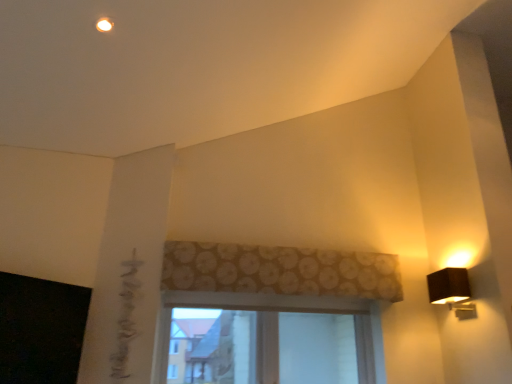
Question: Are black fabric lamp at right and clear glass window at center making contact?

Choices:
 (A) no
 (B) yes

Answer: (A)

Question: Is the position of black fabric lamp at right more distant than that of clear glass window at center?

Choices:
 (A) yes
 (B) no

Answer: (B)

Question: Does black fabric lamp at right have a greater height compared to clear glass window at center?

Choices:
 (A) no
 (B) yes

Answer: (A)

Question: Can you confirm if black fabric lamp at right is bigger than clear glass window at center?

Choices:
 (A) yes
 (B) no

Answer: (B)

Question: Is black fabric lamp at right oriented towards clear glass window at center?

Choices:
 (A) yes
 (B) no

Answer: (A)

Question: Does black fabric lamp at right have a smaller size compared to clear glass window at center?

Choices:
 (A) no
 (B) yes

Answer: (B)

Question: Is brown floral fabric at center bigger than black fabric lamp at right?

Choices:
 (A) no
 (B) yes

Answer: (B)

Question: Is brown floral fabric at center facing towards black fabric lamp at right?

Choices:
 (A) yes
 (B) no

Answer: (B)

Question: Is brown floral fabric at center facing away from black fabric lamp at right?

Choices:
 (A) no
 (B) yes

Answer: (A)

Question: Is brown floral fabric at center to the right of black fabric lamp at right from the viewer's perspective?

Choices:
 (A) no
 (B) yes

Answer: (A)

Question: Considering the relative positions of brown floral fabric at center and black fabric lamp at right in the image provided, is brown floral fabric at center to the left of black fabric lamp at right from the viewer's perspective?

Choices:
 (A) yes
 (B) no

Answer: (A)

Question: Is brown floral fabric at center placed right next to black fabric lamp at right?

Choices:
 (A) yes
 (B) no

Answer: (B)

Question: From a real-world perspective, is clear glass window at center located beneath black fabric lamp at right?

Choices:
 (A) yes
 (B) no

Answer: (A)